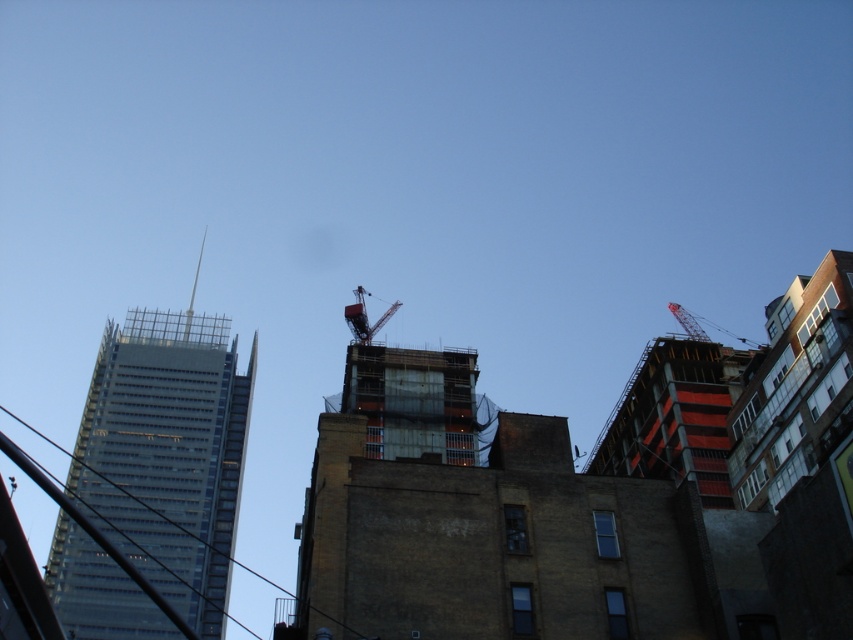
Question: Is transparent glass skyscraper at upper left to the left of metallic red crane at center from the viewer's perspective?

Choices:
 (A) yes
 (B) no

Answer: (A)

Question: Which point is farther to the camera?

Choices:
 (A) (364, 339)
 (B) (728, 333)
 (C) (138, 449)

Answer: (B)

Question: Among these points, which one is nearest to the camera?

Choices:
 (A) (720, 328)
 (B) (357, 333)

Answer: (B)

Question: Is transparent glass skyscraper at upper left thinner than metallic red crane at center?

Choices:
 (A) yes
 (B) no

Answer: (B)

Question: Which point is farther from the camera taking this photo?

Choices:
 (A) (685, 310)
 (B) (369, 340)

Answer: (A)

Question: Is transparent glass skyscraper at upper left closer to camera compared to metallic red crane at upper right?

Choices:
 (A) no
 (B) yes

Answer: (B)